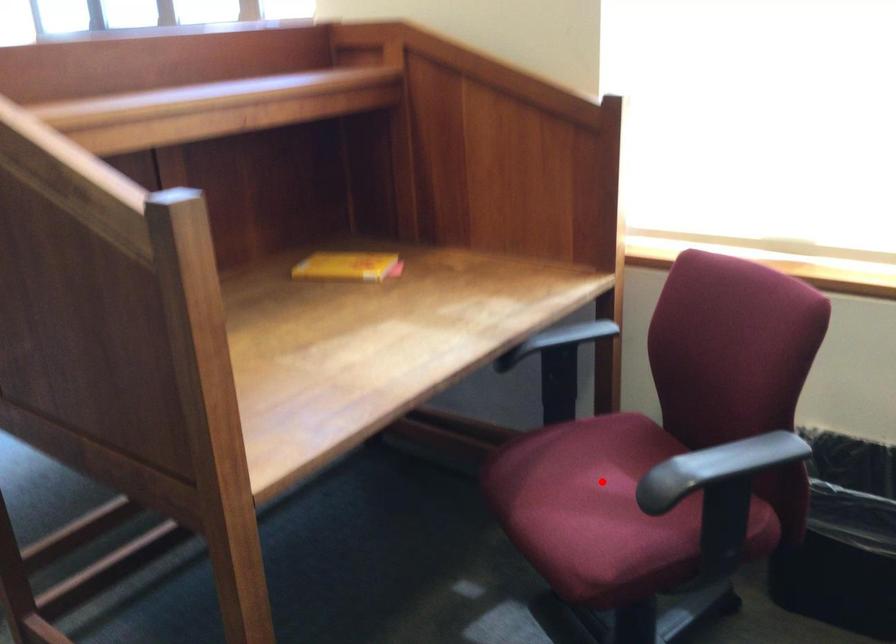
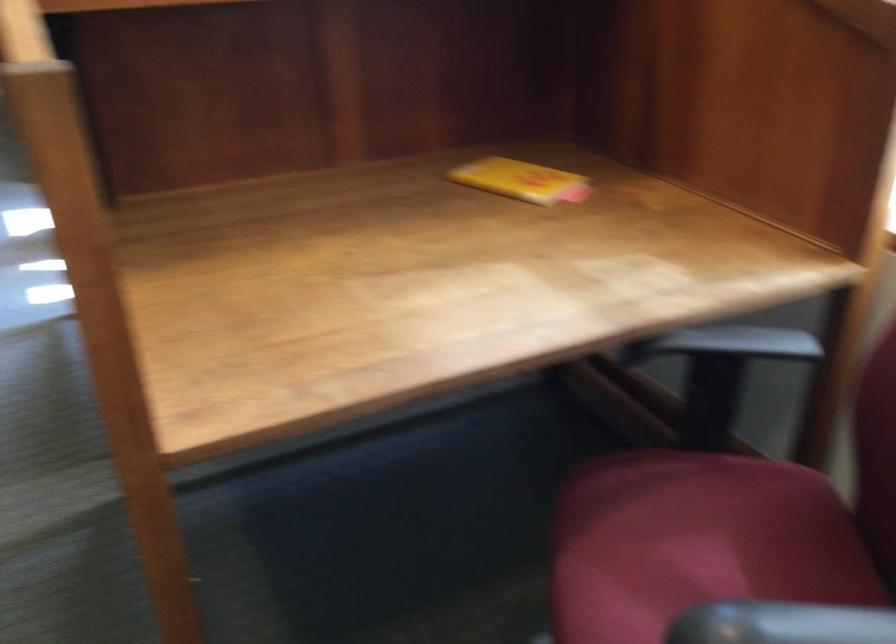
Question: I am providing you with two images of the same scene from different viewpoints. A red point is marked on the first image. Is the red point's position out of view in image 2?

Choices:
 (A) Yes
 (B) No

Answer: (B)